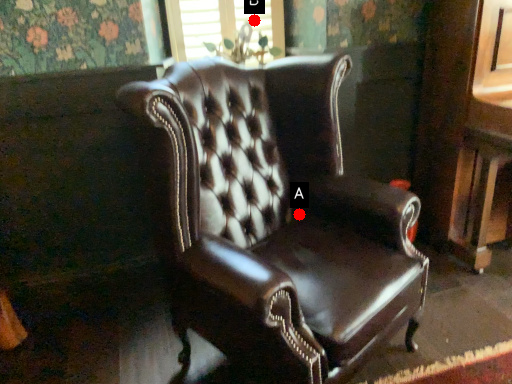
Question: Two points are circled on the image, labeled by A and B beside each circle. Which point appears farthest from the camera in this image?

Choices:
 (A) A is further
 (B) B is further

Answer: (B)